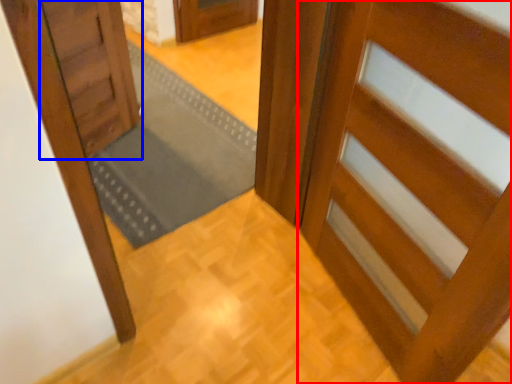
Question: Among these objects, which one is nearest to the camera, door (highlighted by a red box) or door (highlighted by a blue box)?

Choices:
 (A) door
 (B) door

Answer: (A)